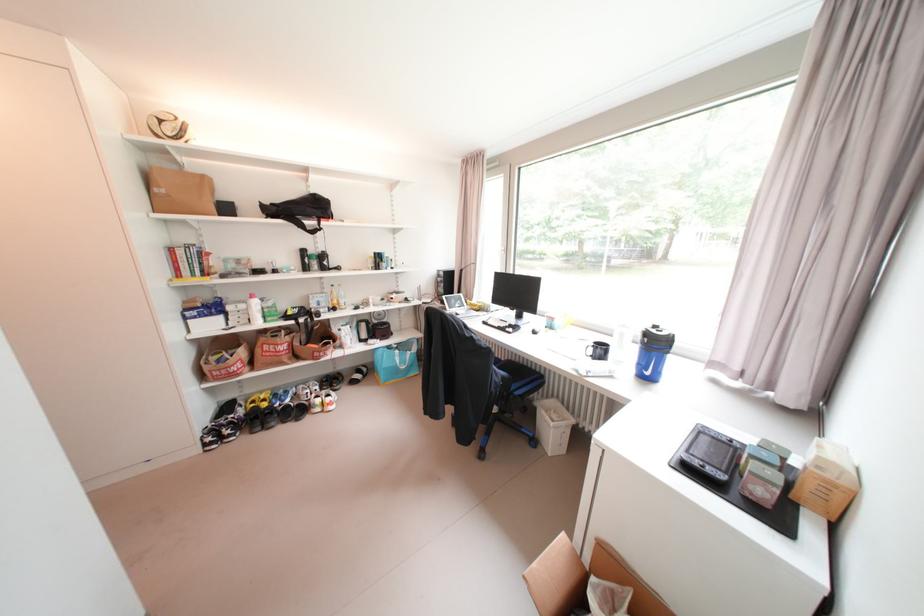
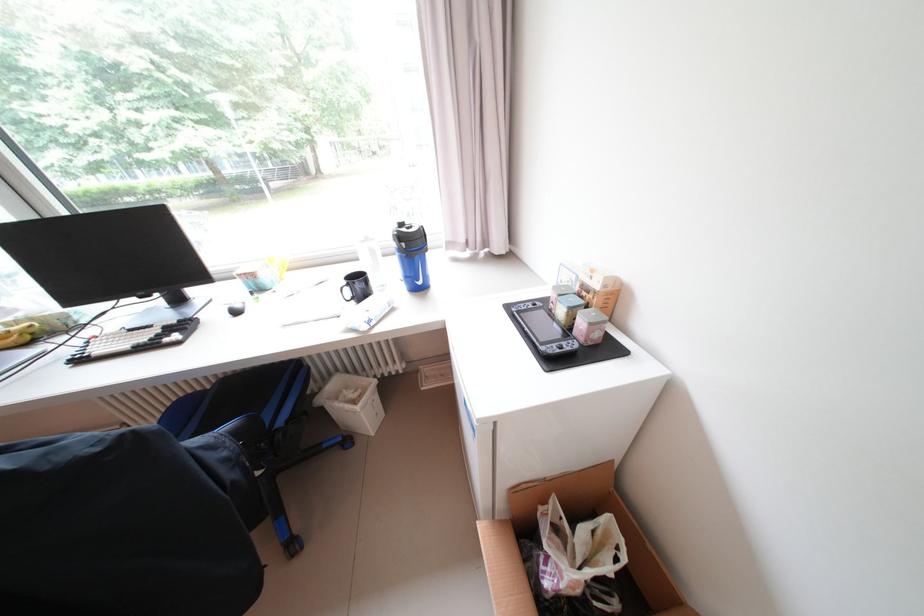
Find the pixel in the second image that matches [655,375] in the first image.

(428, 284)